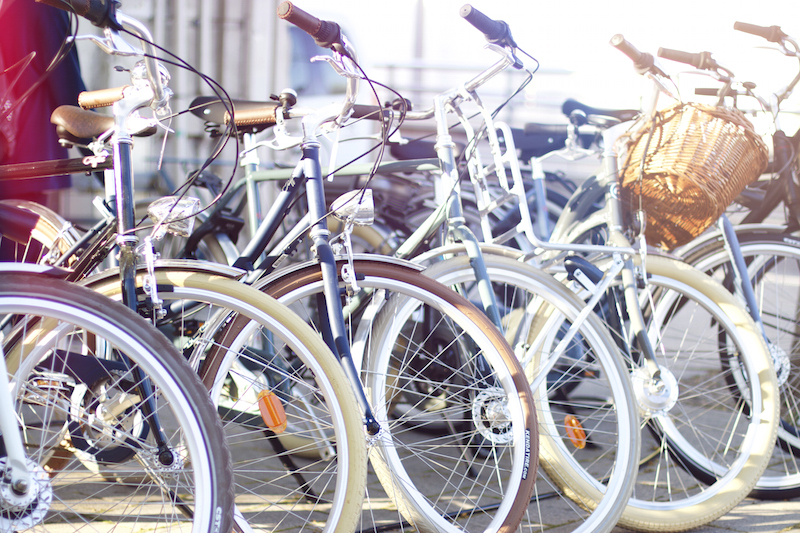
Where is `handles`? The width and height of the screenshot is (800, 533). handles is located at coordinates (308, 22), (80, 13), (474, 22), (626, 43), (686, 49), (761, 26).